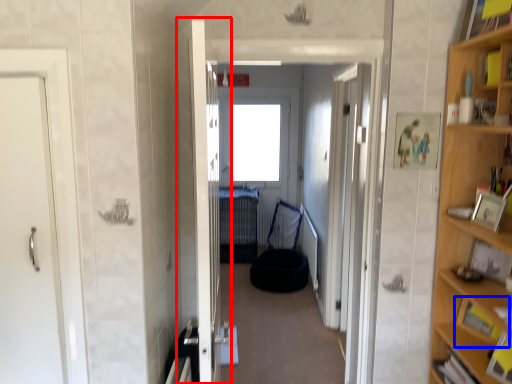
Question: Which object appears closest to the camera in this image, door (highlighted by a red box) or cabinet (highlighted by a blue box)?

Choices:
 (A) door
 (B) cabinet

Answer: (A)